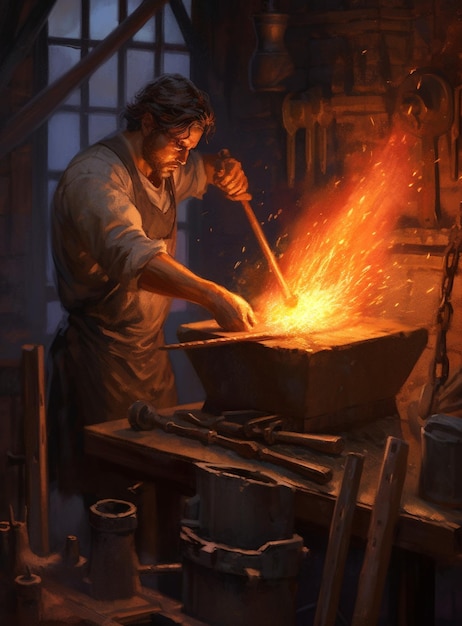
Identify the location of window. This screenshot has height=626, width=462. (99, 16).